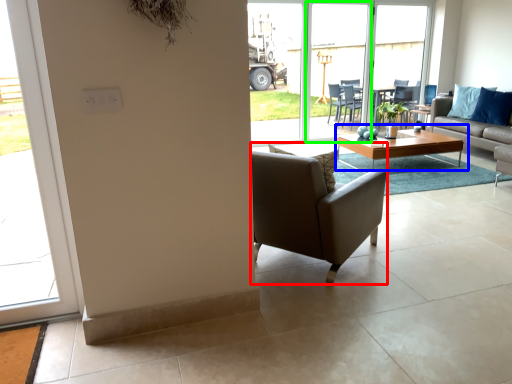
Question: Which is nearer to the chair (highlighted by a red box)? coffee table (highlighted by a blue box) or screen door (highlighted by a green box).

Choices:
 (A) coffee table
 (B) screen door

Answer: (A)